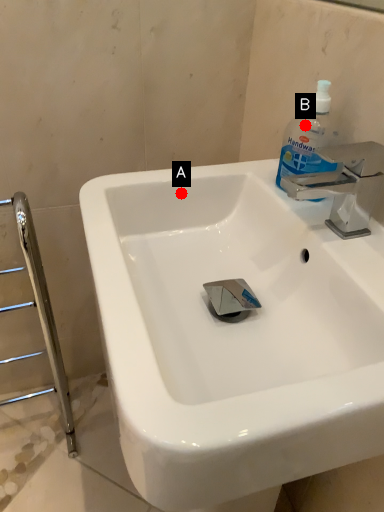
Question: Two points are circled on the image, labeled by A and B beside each circle. Among these points, which one is farthest from the camera?

Choices:
 (A) A is further
 (B) B is further

Answer: (A)